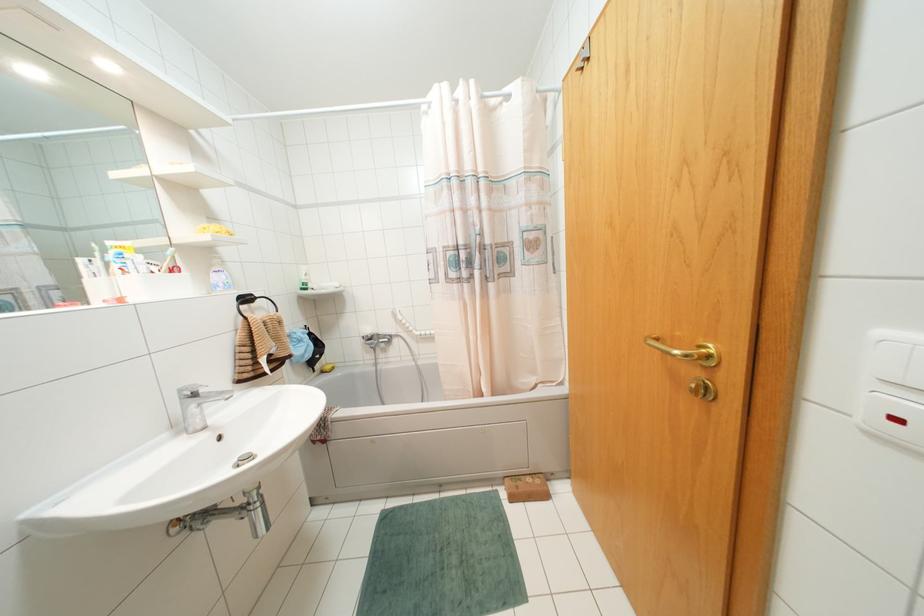
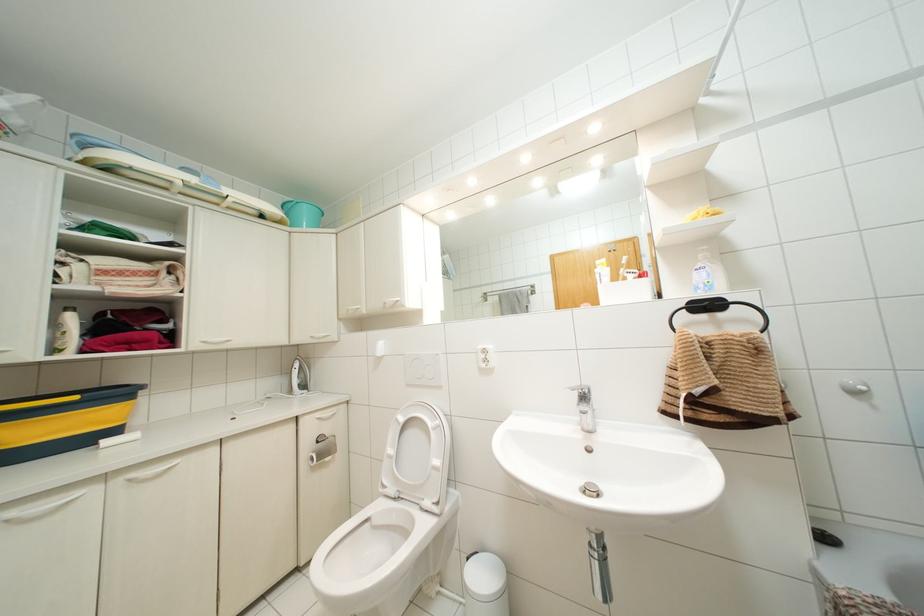
Locate, in the second image, the point that corresponds to [223,276] in the first image.

(703, 274)